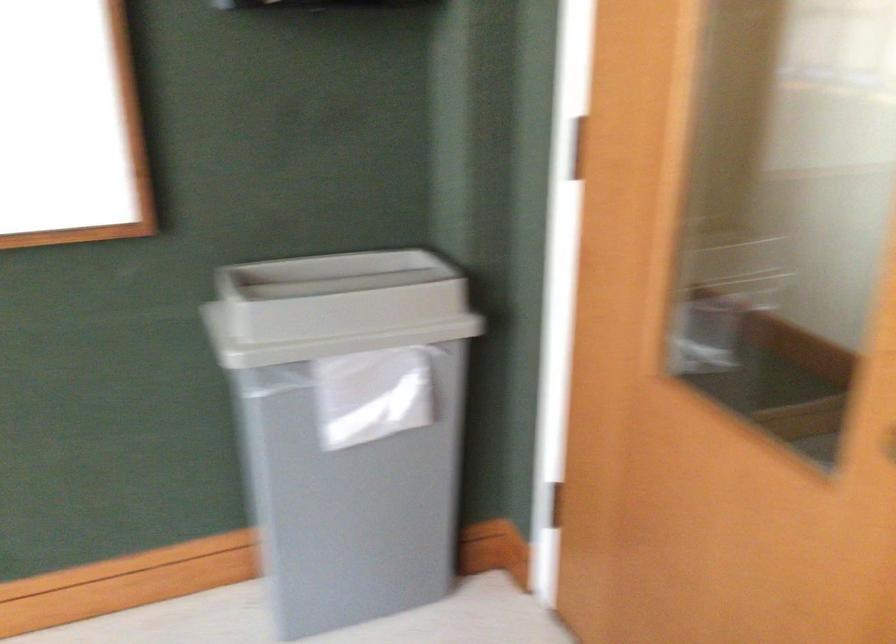
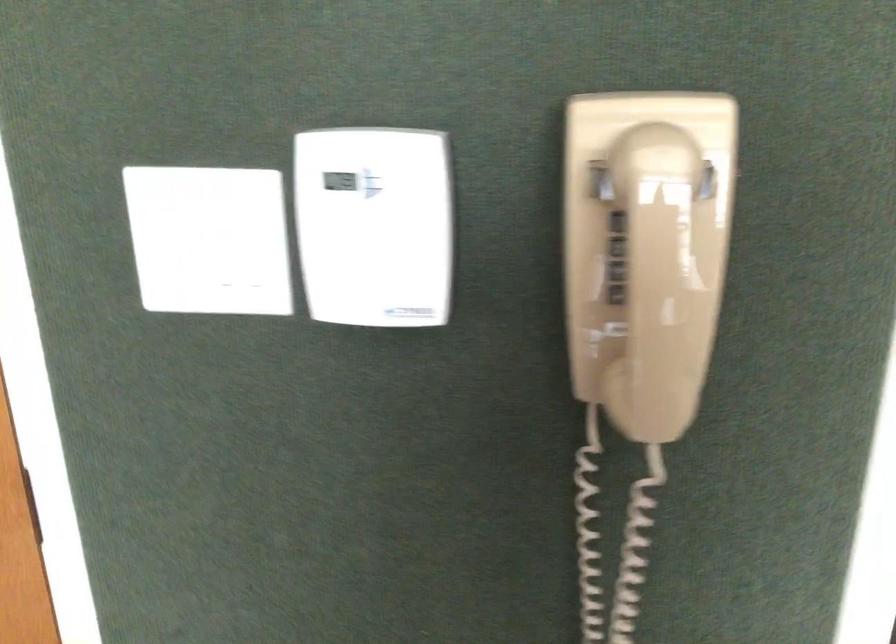
Question: The camera is either moving clockwise (left) or counter-clockwise (right) around the object. The first image is from the beginning of the video and the second image is from the end. Is the camera moving left or right when shooting the video?

Choices:
 (A) Left
 (B) Right

Answer: (A)